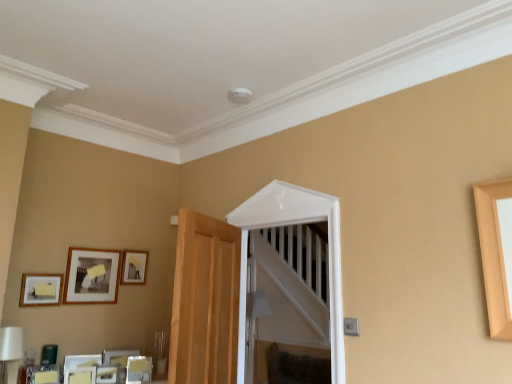
Question: Does wooden picture frame at upper left, marked as the 4th picture frame in a bottom-to-top arrangement, have a larger size compared to matte black picture frame at upper left, the 3th picture frame ordered from the bottom?

Choices:
 (A) no
 (B) yes

Answer: (A)

Question: Considering the relative sizes of wooden picture frame at upper left, which is counted as the 1th picture frame, starting from the top, and matte black picture frame at upper left, the 2th picture frame viewed from the top, in the image provided, is wooden picture frame at upper left, which is counted as the 1th picture frame, starting from the top, shorter than matte black picture frame at upper left, the 2th picture frame viewed from the top,?

Choices:
 (A) no
 (B) yes

Answer: (B)

Question: Is matte black picture frame at upper left, the 3th picture frame ordered from the bottom, at the back of wooden picture frame at upper left, marked as the 4th picture frame in a bottom-to-top arrangement?

Choices:
 (A) yes
 (B) no

Answer: (B)

Question: Can matte black picture frame at upper left, the 2th picture frame viewed from the top, be found inside wooden picture frame at upper left, marked as the 4th picture frame in a bottom-to-top arrangement?

Choices:
 (A) yes
 (B) no

Answer: (B)

Question: Is wooden picture frame at upper left, marked as the 4th picture frame in a bottom-to-top arrangement, completely or partially outside of matte black picture frame at upper left, the 3th picture frame ordered from the bottom?

Choices:
 (A) yes
 (B) no

Answer: (A)

Question: Considering the positions of matte black picture frame at lower left, the second picture frame when ordered from bottom to top, and white glossy door at center in the image, is matte black picture frame at lower left, the second picture frame when ordered from bottom to top, wider or thinner than white glossy door at center?

Choices:
 (A) wide
 (B) thin

Answer: (B)

Question: Considering the positions of matte black picture frame at lower left, the 3th picture frame viewed from the top, and white glossy door at center in the image, is matte black picture frame at lower left, the 3th picture frame viewed from the top, bigger or smaller than white glossy door at center?

Choices:
 (A) small
 (B) big

Answer: (A)

Question: From their relative heights in the image, would you say matte black picture frame at lower left, the second picture frame when ordered from bottom to top, is taller or shorter than white glossy door at center?

Choices:
 (A) short
 (B) tall

Answer: (A)

Question: From a real-world perspective, is matte black picture frame at lower left, the 3th picture frame viewed from the top, above or below white glossy door at center?

Choices:
 (A) above
 (B) below

Answer: (B)

Question: Is matte wooden picture frame at lower left, which is the 1th picture frame from bottom to top, situated inside white glossy door at center or outside?

Choices:
 (A) outside
 (B) inside

Answer: (A)

Question: From a real-world perspective, is matte wooden picture frame at lower left, which is the 1th picture frame from bottom to top, positioned above or below white glossy door at center?

Choices:
 (A) below
 (B) above

Answer: (A)

Question: Looking at their shapes, would you say matte wooden picture frame at lower left, which is the 1th picture frame from bottom to top, is wider or thinner than white glossy door at center?

Choices:
 (A) thin
 (B) wide

Answer: (A)

Question: Is matte wooden picture frame at lower left, arranged as the fourth picture frame when viewed from the top, taller or shorter than white glossy door at center?

Choices:
 (A) tall
 (B) short

Answer: (B)

Question: Is point (137, 268) positioned closer to the camera than point (41, 284)?

Choices:
 (A) farther
 (B) closer

Answer: (A)

Question: Looking at the image, does wooden picture frame at upper left, marked as the 4th picture frame in a bottom-to-top arrangement, seem bigger or smaller compared to matte black picture frame at lower left, the 3th picture frame viewed from the top?

Choices:
 (A) big
 (B) small

Answer: (A)